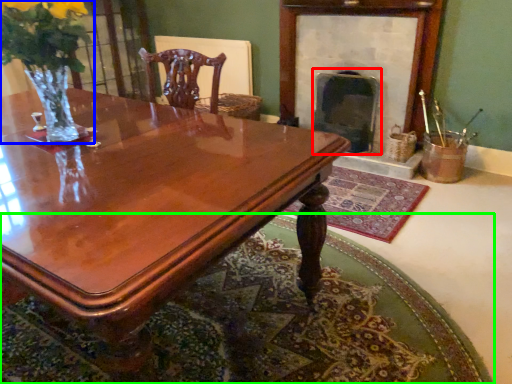
Question: Based on their relative distances, which object is farther from fireplace (highlighted by a red box)? Choose from floral arrangement (highlighted by a blue box) and mat (highlighted by a green box).

Choices:
 (A) floral arrangement
 (B) mat

Answer: (A)